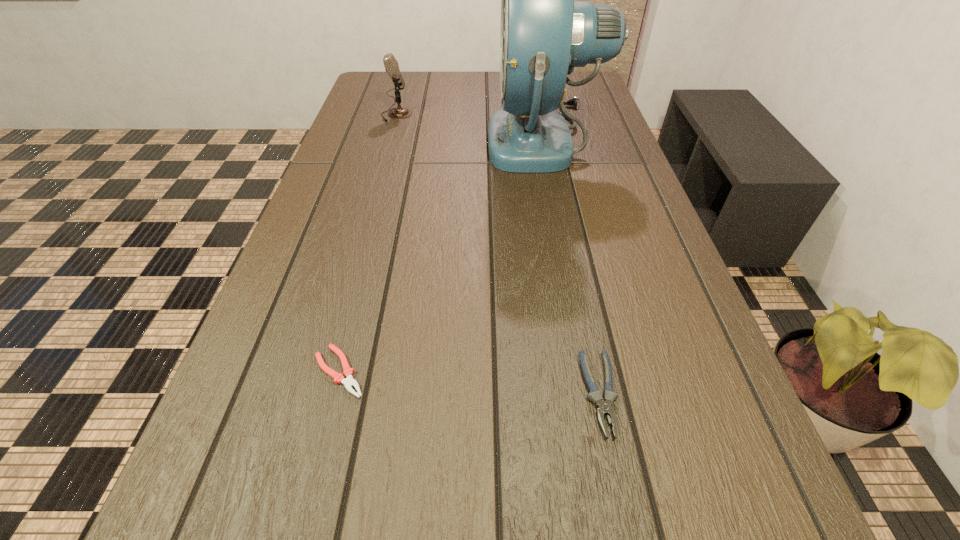
This screenshot has height=540, width=960. I want to click on fan, so click(x=544, y=34).

You are a GUI agent. You are given a task and a screenshot of the screen. Output one action in this format:
    pyautogui.click(x=<x>, y=<y>)
    Task: Click on the microphone
    This screenshot has width=960, height=540.
    Given the screenshot: What is the action you would take?
    pyautogui.click(x=391, y=65)

Image resolution: width=960 pixels, height=540 pixels. Identify the location of the right pliers. (604, 407).

In order to click on the second shortest object in this screenshot , I will do `click(604, 407)`.

At what (x,y) coordinates should I click in order to perform the action: click on the shorter pliers. Please return your answer as a coordinate pair (x, y). Looking at the image, I should click on (349, 382).

You are a GUI agent. You are given a task and a screenshot of the screen. Output one action in this format:
    pyautogui.click(x=<x>, y=<y>)
    Task: Click on the shortest object
    The width and height of the screenshot is (960, 540).
    Given the screenshot: What is the action you would take?
    pyautogui.click(x=349, y=382)

This screenshot has height=540, width=960. In order to click on free spot located 0.110m in front of the tallest object to blow air in this screenshot , I will do `click(448, 140)`.

This screenshot has width=960, height=540. What are the coordinates of `free space located 0.110m in front of the tallest object to blow air` in the screenshot? It's located at (448, 140).

Identify the location of vacant space located 0.180m in front of the tallest object to blow air. (423, 140).

Locate an element on the screen. The height and width of the screenshot is (540, 960). vacant region located on the front-facing side of the third shortest object is located at coordinates (502, 115).